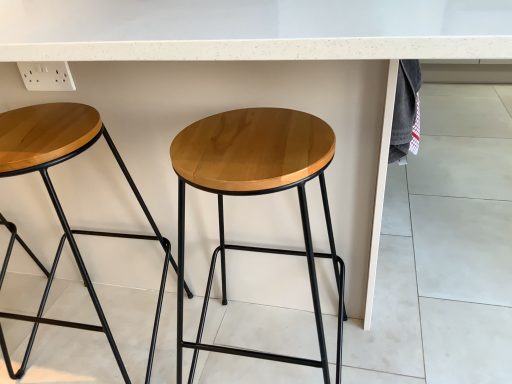
Locate an element on the screen. free spot to the right of natural wood stool at center, which is the first stool from right to left is located at coordinates (406, 332).